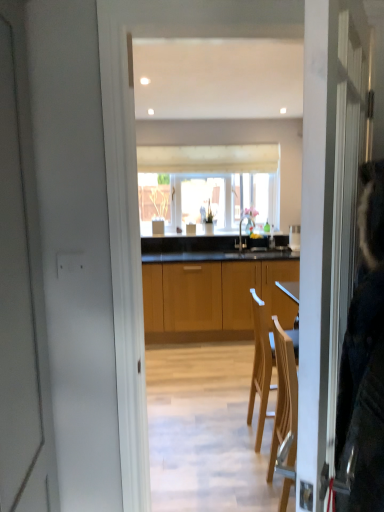
What do you see at coordinates (241, 229) in the screenshot? I see `matte silver faucet at center` at bounding box center [241, 229].

Describe the element at coordinates (208, 184) in the screenshot. I see `white fabric window at center` at that location.

Locate an element on the screen. The height and width of the screenshot is (512, 384). matte silver faucet at center is located at coordinates (241, 229).

Looking at this image, can you tell me how much white glossy kettle at center and wooden cabinets at center differ in facing direction?

The facing directions of white glossy kettle at center and wooden cabinets at center are 2.67 degrees apart.

Which is more to the right, white glossy kettle at center or wooden cabinets at center?

From the viewer's perspective, white glossy kettle at center appears more on the right side.

Is white glossy kettle at center far from wooden cabinets at center?

No, white glossy kettle at center is not far away from wooden cabinets at center.

Could you tell me if white fabric window at center is turned towards wooden cabinets at center?

No, white fabric window at center is not turned towards wooden cabinets at center.

How many degrees apart are the facing directions of white fabric window at center and wooden cabinets at center?

The facing directions of white fabric window at center and wooden cabinets at center are 0.0755 degrees apart.

Which object is closer to the camera, white fabric window at center or wooden cabinets at center?

wooden cabinets at center is in front.

Is white fabric window at center wider than wooden cabinets at center?

In fact, white fabric window at center might be narrower than wooden cabinets at center.

Which is behind, point (233, 185) or point (297, 234)?

Positioned behind is point (233, 185).

Between white fabric window at center and white glossy kettle at center, which one has larger size?

With larger size is white fabric window at center.

This screenshot has width=384, height=512. Find the location of `kitchen appliance lying in front of the white fabric window at center`. kitchen appliance lying in front of the white fabric window at center is located at coordinates (294, 237).

From a real-world perspective, does white fabric window at center stand above white glossy kettle at center?

Yes, from a real-world perspective, white fabric window at center is above white glossy kettle at center.

Considering the positions of objects white glossy kettle at center and white fabric window at center in the image provided, who is more to the right, white glossy kettle at center or white fabric window at center?

From the viewer's perspective, white glossy kettle at center appears more on the right side.

Does white glossy kettle at center turn towards white fabric window at center?

No, white glossy kettle at center does not turn towards white fabric window at center.

Is white glossy kettle at center situated inside white fabric window at center or outside?

white glossy kettle at center is outside white fabric window at center.

How distant is wooden cabinets at center from white fabric window at center?

The distance of wooden cabinets at center from white fabric window at center is 38.36 inches.

Consider the image. Is wooden cabinets at center beside white fabric window at center?

No, wooden cabinets at center is not touching white fabric window at center.

Which is more to the right, wooden cabinets at center or white fabric window at center?

Positioned to the right is wooden cabinets at center.

Which of these two, wooden cabinets at center or white fabric window at center, is bigger?

Bigger between the two is wooden cabinets at center.

Can you confirm if matte silver faucet at center is positioned to the left of white fabric window at center?

Incorrect, matte silver faucet at center is not on the left side of white fabric window at center.

Does matte silver faucet at center come in front of white fabric window at center?

Yes, it is.

You are a GUI agent. You are given a task and a screenshot of the screen. Output one action in this format:
    pyautogui.click(x=<x>, y=<y>)
    Task: Click on the tap located underneath the white fabric window at center (from a real-world perspective)
    The width and height of the screenshot is (384, 512).
    Given the screenshot: What is the action you would take?
    pyautogui.click(x=241, y=229)

Considering the sizes of matte silver faucet at center and white fabric window at center in the image, is matte silver faucet at center wider or thinner than white fabric window at center?

In the image, matte silver faucet at center appears to be wider than white fabric window at center.

Is wooden cabinets at center positioned with its back to matte silver faucet at center?

That's not correct — wooden cabinets at center is not looking away from matte silver faucet at center.

Is point (203, 265) in front of point (247, 215)?

Yes, point (203, 265) is closer to viewer.

Consider the image. Is wooden cabinets at center situated inside matte silver faucet at center or outside?

wooden cabinets at center is not enclosed by matte silver faucet at center.

You are a GUI agent. You are given a task and a screenshot of the screen. Output one action in this format:
    pyautogui.click(x=<x>, y=<y>)
    Task: Click on the cabinetry below the white glossy kettle at center (from the image's perspective)
    
    Given the screenshot: What is the action you would take?
    pyautogui.click(x=213, y=298)

Image resolution: width=384 pixels, height=512 pixels. I want to click on window lying above the wooden cabinets at center (from the image's perspective), so click(x=208, y=184).

Looking at the image, which one is located closer to matte silver faucet at center, white fabric window at center or wooden cabinets at center?

Based on the image, white fabric window at center appears to be nearer to matte silver faucet at center.

When comparing their distances from white fabric window at center, does matte silver faucet at center or wooden cabinets at center seem closer?

matte silver faucet at center lies closer to white fabric window at center than the other object.

Estimate the real-world distances between objects in this image. Which object is closer to white glossy kettle at center, matte silver faucet at center or white fabric window at center?

matte silver faucet at center lies closer to white glossy kettle at center than the other object.

When comparing their distances from white glossy kettle at center, does white fabric window at center or wooden cabinets at center seem further?

white fabric window at center.

When comparing their distances from white glossy kettle at center, does white fabric window at center or matte silver faucet at center seem further?

white fabric window at center lies further to white glossy kettle at center than the other object.

When comparing their distances from white fabric window at center, does white glossy kettle at center or wooden cabinets at center seem further?

white glossy kettle at center lies further to white fabric window at center than the other object.

From the picture: Which object lies nearer to the anchor point white fabric window at center, wooden cabinets at center or white glossy kettle at center?

Based on the image, wooden cabinets at center appears to be nearer to white fabric window at center.

When comparing their distances from wooden cabinets at center, does white fabric window at center or white glossy kettle at center seem closer?

The object closer to wooden cabinets at center is white fabric window at center.

Locate an element on the screen. This screenshot has width=384, height=512. kitchen appliance between white fabric window at center and wooden cabinets at center in the up-down direction is located at coordinates (294, 237).

The image size is (384, 512). I want to click on tap between wooden cabinets at center and white glossy kettle at center, so click(241, 229).

The height and width of the screenshot is (512, 384). In order to click on tap located between white fabric window at center and white glossy kettle at center in the left-right direction in this screenshot , I will do `click(241, 229)`.

What are the coordinates of `tap between white fabric window at center and wooden cabinets at center in the up-down direction` in the screenshot? It's located at (241, 229).